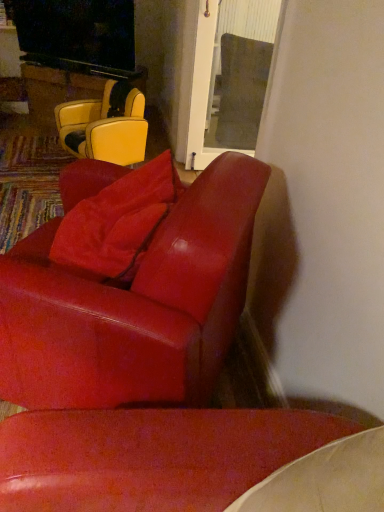
Question: From the image's perspective, is suede-like red pillow at center above or below leather yellow chair at upper left, placed as the 2th chair when sorted from bottom to top?

Choices:
 (A) above
 (B) below

Answer: (B)

Question: In terms of width, does suede-like red pillow at center look wider or thinner when compared to leather yellow chair at upper left, acting as the 1th chair starting from the top?

Choices:
 (A) wide
 (B) thin

Answer: (B)

Question: Which object is positioned closest to the wooden glossy table at upper left?

Choices:
 (A) suede-like red pillow at center
 (B) leather yellow chair at upper left, placed as the 2th chair when sorted from bottom to top
 (C) matte red leather chair at center, positioned as the 1th chair in front-to-back order

Answer: (B)

Question: Estimate the real-world distances between objects in this image. Which object is closer to the suede-like red pillow at center?

Choices:
 (A) wooden glossy table at upper left
 (B) leather yellow chair at upper left, placed as the 2th chair when sorted from bottom to top
 (C) matte red leather chair at center, positioned as the 1th chair in front-to-back order

Answer: (C)